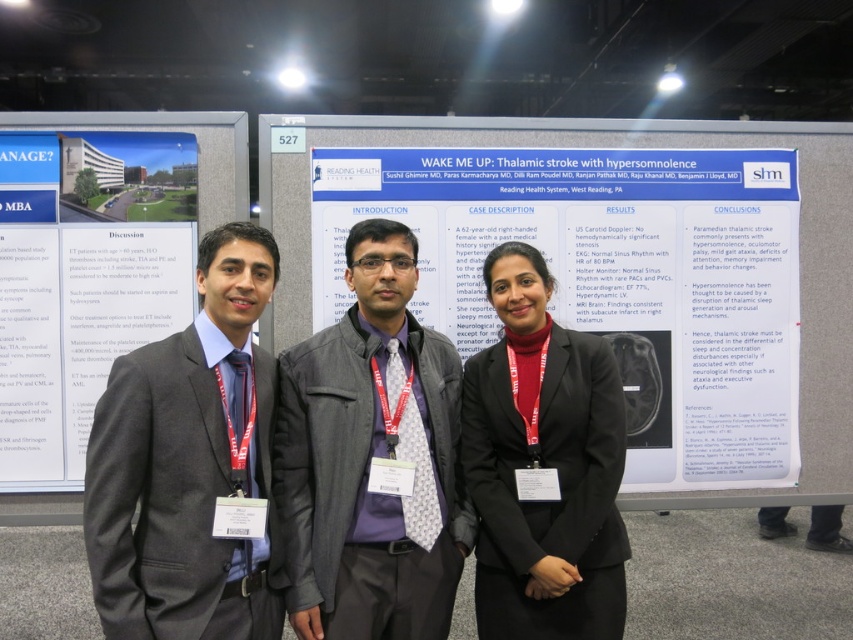
Question: Can you confirm if matte black suit at center is positioned below blue paperboard poster at left?

Choices:
 (A) yes
 (B) no

Answer: (A)

Question: Estimate the real-world distances between objects in this image. Which object is closer to the white paperboard at center?

Choices:
 (A) blue paperboard poster at left
 (B) matte black suit at center

Answer: (B)

Question: Can you confirm if white paperboard at center is positioned to the right of blue paperboard poster at left?

Choices:
 (A) no
 (B) yes

Answer: (B)

Question: Which object is the farthest from the gray fabric jacket at center?

Choices:
 (A) matte black suit at center
 (B) matte black blazer at center

Answer: (A)

Question: Can you confirm if white paperboard at center is positioned to the left of blue paperboard poster at left?

Choices:
 (A) yes
 (B) no

Answer: (B)

Question: Which point appears closest to the camera in this image?

Choices:
 (A) (477, 573)
 (B) (119, 250)
 (C) (643, 481)
 (D) (215, 394)

Answer: (D)